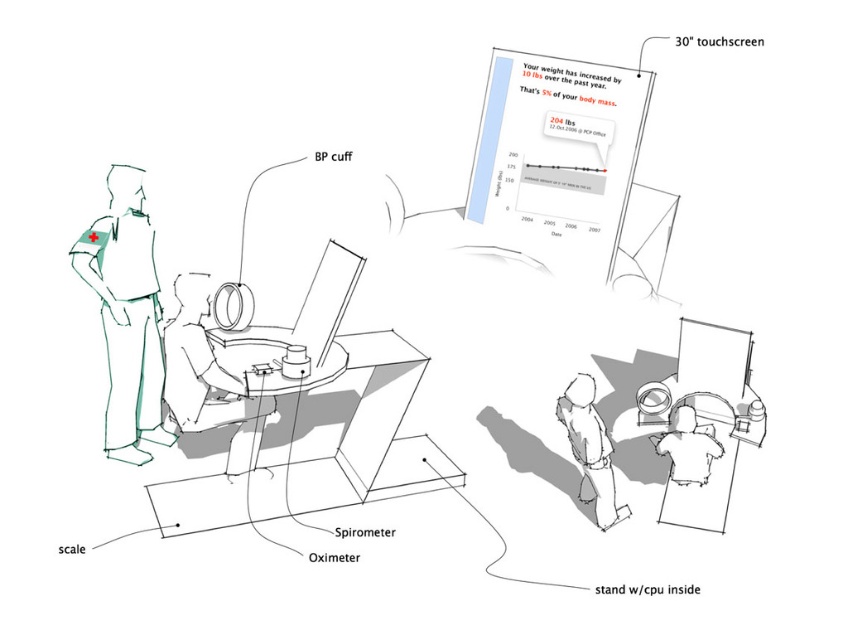
Question: Which point is farther from the camera taking this photo?

Choices:
 (A) (690, 452)
 (B) (82, 236)
 (C) (555, 410)

Answer: (B)

Question: Is matte black monitor at center wider than light gray pants at lower center?

Choices:
 (A) no
 (B) yes

Answer: (B)

Question: Which point is farther from the camera taking this photo?

Choices:
 (A) (615, 513)
 (B) (235, 433)
 (C) (685, 436)

Answer: (B)

Question: Is green fabric shirt at left wider than light gray pants at lower center?

Choices:
 (A) no
 (B) yes

Answer: (A)

Question: Does light gray pants at lower center have a larger size compared to white glossy shirt at center?

Choices:
 (A) no
 (B) yes

Answer: (B)

Question: Which point is closer to the camera taking this photo?

Choices:
 (A) (204, 416)
 (B) (583, 474)
 (C) (678, 444)

Answer: (A)